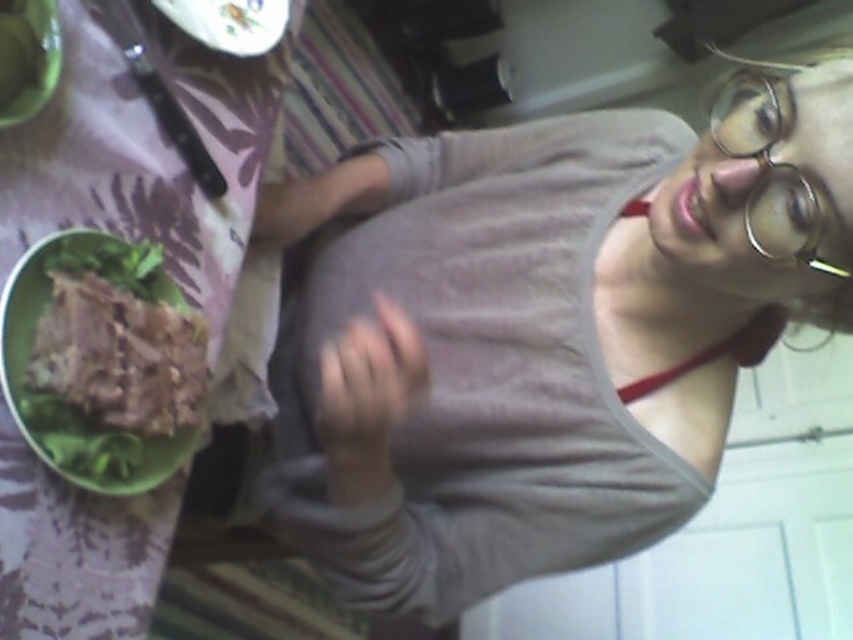
Does green matte bowl at left appear under white glossy plate at upper center?

Yes, green matte bowl at left is below white glossy plate at upper center.

Who is positioned more to the right, green matte bowl at left or white glossy plate at upper center?

Positioned to the right is white glossy plate at upper center.

Where is `green matte bowl at left`? The height and width of the screenshot is (640, 853). green matte bowl at left is located at coordinates (102, 362).

Locate an element on the screen. The image size is (853, 640). green matte bowl at left is located at coordinates (102, 362).

Who is higher up, gray cotton tank top at center or green plastic bowl at upper left?

green plastic bowl at upper left is above.

Is gray cotton tank top at center behind green plastic bowl at upper left?

No, it is not.

Which is in front, point (648, 371) or point (260, 81)?

Point (648, 371) is in front.

Locate an element on the screen. This screenshot has width=853, height=640. gray cotton tank top at center is located at coordinates (548, 330).

Is point (689, 276) positioned after point (177, 420)?

Yes, point (689, 276) is behind point (177, 420).

Is point (601, 301) closer to viewer compared to point (125, 253)?

No.

Where is `gray cotton tank top at center`? gray cotton tank top at center is located at coordinates (548, 330).